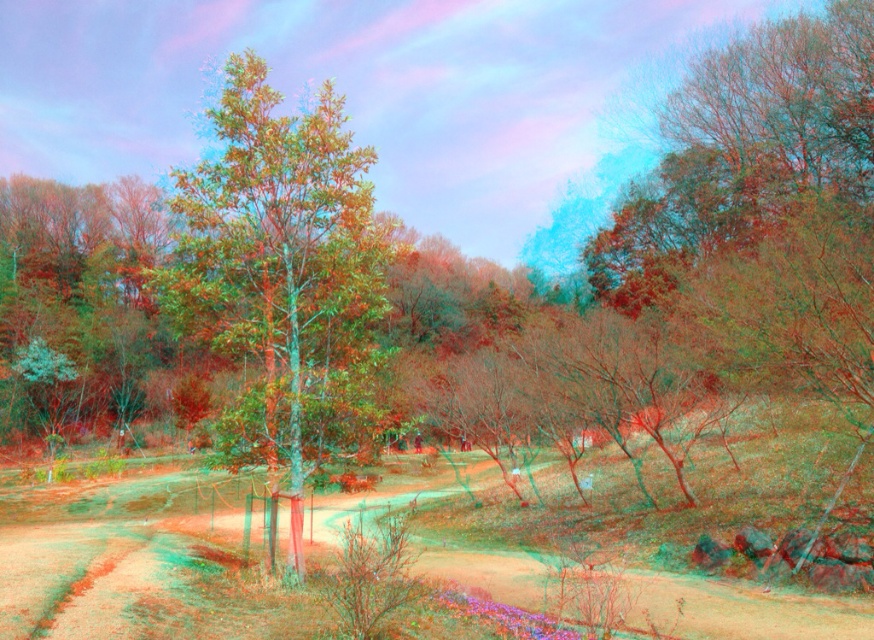
Is brown dirt track at center above green matte tree at center?

No, brown dirt track at center is not above green matte tree at center.

Does brown dirt track at center have a larger size compared to green matte tree at center?

No.

At what (x,y) coordinates should I click in order to perform the action: click on brown dirt track at center. Please return your answer as a coordinate pair (x, y). The width and height of the screenshot is (874, 640). Looking at the image, I should click on (137, 564).